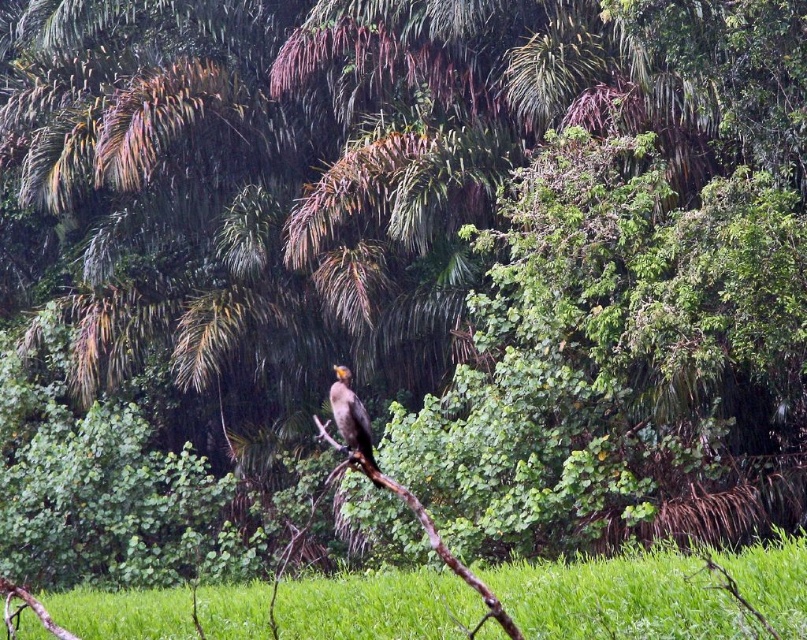
Question: Which object is closer to the camera taking this photo?

Choices:
 (A) green grass at lower center
 (B) shiny brown bird at center

Answer: (A)

Question: Does green grass at lower center appear on the right side of brown wood at center?

Choices:
 (A) no
 (B) yes

Answer: (A)

Question: Which point appears closest to the camera in this image?

Choices:
 (A) (143, 636)
 (B) (433, 548)
 (C) (350, 449)

Answer: (C)

Question: Is green grass at lower center bigger than brown wood at center?

Choices:
 (A) no
 (B) yes

Answer: (B)

Question: Which point is farther to the camera?

Choices:
 (A) (358, 449)
 (B) (442, 547)

Answer: (A)

Question: Does brown wood at center appear on the left side of shiny brown bird at center?

Choices:
 (A) no
 (B) yes

Answer: (A)